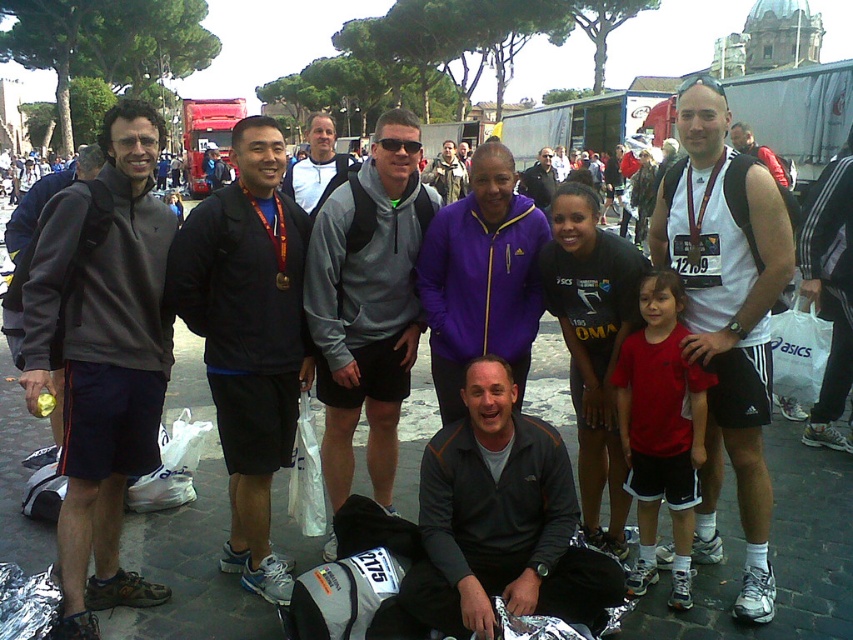
You are standing in front of the group of people in the photo. You notice two points marked in the image. The first point is at coordinate point (131, 160) and the second is at point (399, 269). If you want to reach both points by walking straight ahead, which point will you reach first?

Point (131, 160) is closer to the viewer than point (399, 269), so you will reach point (131, 160) first.

In the photo of runners after a race, there are two people wearing a gray fleece hoodie at center and a matte black jacket at center. From the perspective of someone standing in front of the group, which clothing item is positioned to the left?

The gray fleece hoodie at center is to the left of the matte black jacket at center.

You are a photographer trying to capture the group photo. You notice the gray fleece hoodie at center and the matte black jacket at center. Which one is positioned in front of the other?

The gray fleece hoodie at center is closer to the viewer than the matte black jacket at center, so it is positioned in front of the matte black jacket at center.